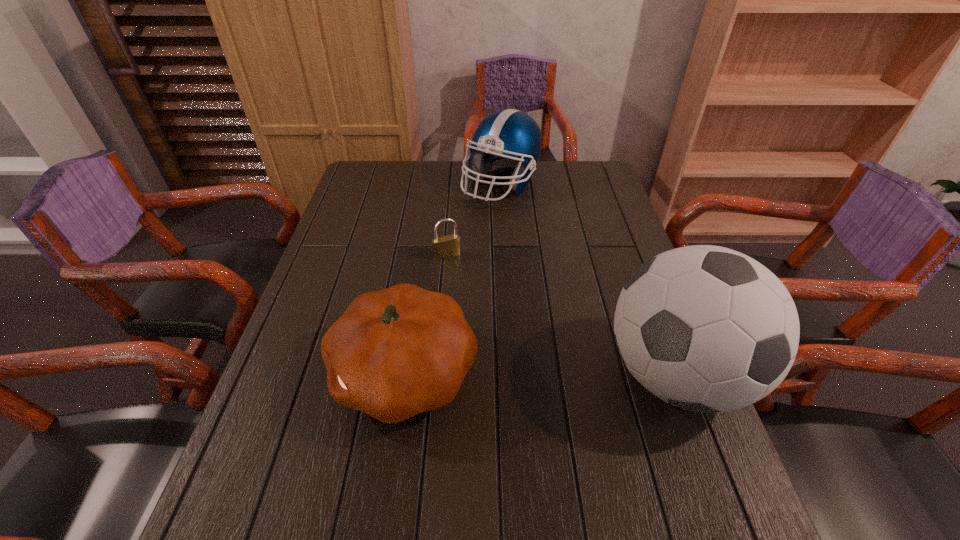
Where is `free space located on the front-facing side of the third nearest object`? The image size is (960, 540). free space located on the front-facing side of the third nearest object is located at coordinates (488, 329).

The height and width of the screenshot is (540, 960). Identify the location of vacant space situated 0.240m at the front of the football helmet with the faceguard. (525, 258).

Identify the location of vacant region located 0.230m at the front of the football helmet with the faceguard. tap(524, 255).

The height and width of the screenshot is (540, 960). In order to click on free spot located 0.390m at the front of the football helmet with the faceguard in this screenshot , I will do `click(538, 294)`.

The image size is (960, 540). What are the coordinates of `object that is at the far edge` in the screenshot? It's located at (508, 137).

The image size is (960, 540). In order to click on object situated at the near edge in this screenshot , I will do `click(705, 328)`.

At what (x,y) coordinates should I click in order to perform the action: click on object present at the left edge. Please return your answer as a coordinate pair (x, y). Looking at the image, I should click on (394, 353).

Where is `object located at the right edge`? This screenshot has height=540, width=960. object located at the right edge is located at coordinates (705, 328).

What are the coordinates of `object that is at the near right corner` in the screenshot? It's located at click(705, 328).

Identify the location of vacant area at the far edge of the desktop. (460, 184).